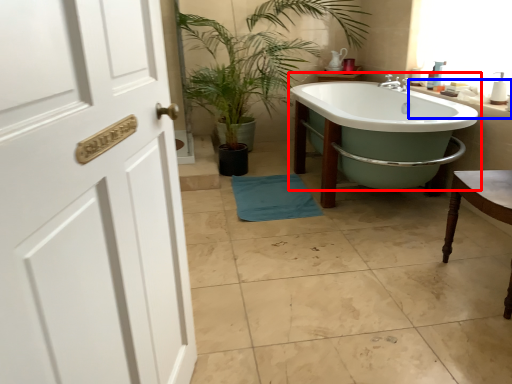
Question: Which of the following is the farthest to the observer, bathtub (highlighted by a red box) or counter top (highlighted by a blue box)?

Choices:
 (A) bathtub
 (B) counter top

Answer: (B)